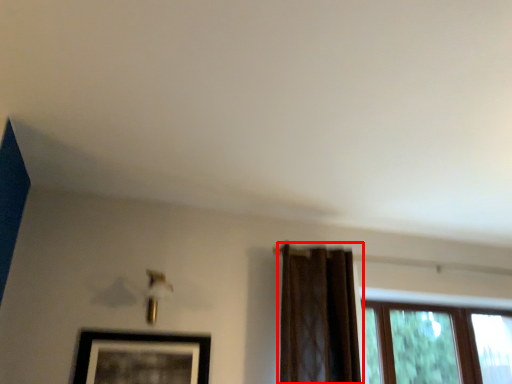
Question: From the image's perspective, what is the correct spatial positioning of curtain (annotated by the red box) in reference to picture frame?

Choices:
 (A) above
 (B) below

Answer: (A)